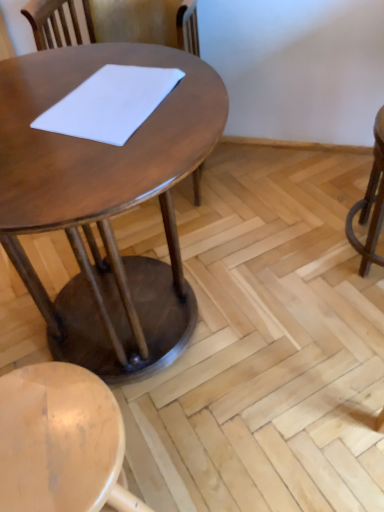
Identify the location of blank space above shiny brown table at center (from a real-world perspective). The width and height of the screenshot is (384, 512). (87, 99).